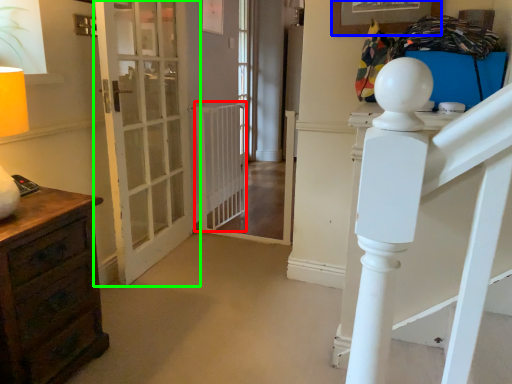
Question: Considering the real-world distances, which object is closest to radiator (highlighted by a red box)? picture frame (highlighted by a blue box) or door (highlighted by a green box).

Choices:
 (A) picture frame
 (B) door

Answer: (B)